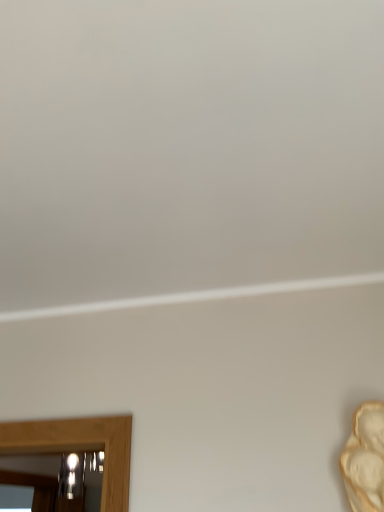
Question: Visually, is white plaster mask at right positioned to the left or to the right of metallic reflective mirror at lower left?

Choices:
 (A) left
 (B) right

Answer: (B)

Question: Based on their sizes in the image, would you say white plaster mask at right is bigger or smaller than metallic reflective mirror at lower left?

Choices:
 (A) big
 (B) small

Answer: (B)

Question: Is white plaster mask at right wider or thinner than metallic reflective mirror at lower left?

Choices:
 (A) wide
 (B) thin

Answer: (B)

Question: Is metallic reflective mirror at lower left wider or thinner than white plaster mask at right?

Choices:
 (A) thin
 (B) wide

Answer: (B)

Question: From a real-world perspective, is metallic reflective mirror at lower left physically located above or below white plaster mask at right?

Choices:
 (A) below
 (B) above

Answer: (B)

Question: Do you think metallic reflective mirror at lower left is within white plaster mask at right, or outside of it?

Choices:
 (A) inside
 (B) outside

Answer: (B)

Question: In the image, is metallic reflective mirror at lower left positioned in front of or behind white plaster mask at right?

Choices:
 (A) behind
 (B) front

Answer: (A)